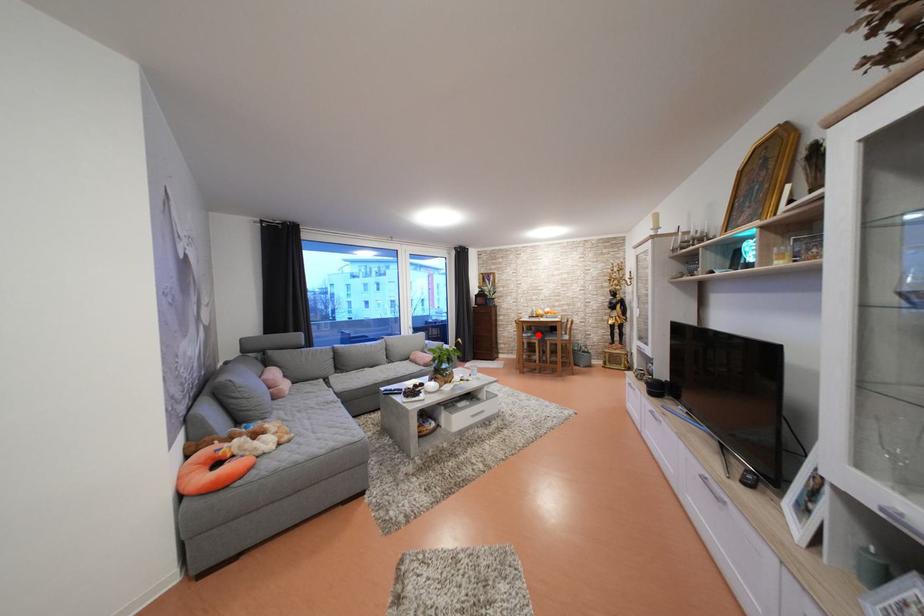
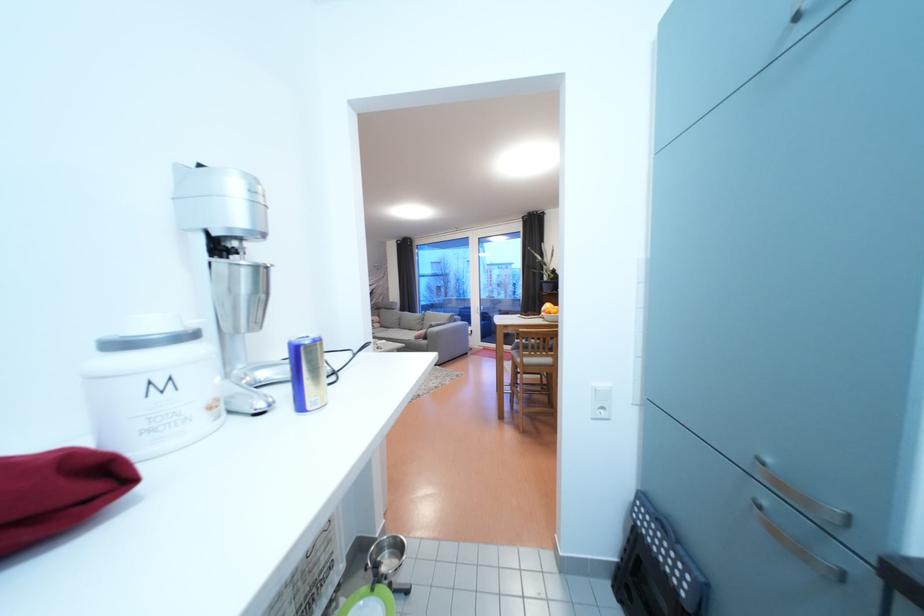
Question: I am providing you with two images of the same scene from different viewpoints. A red point is marked on the first image. At the location where the point appears in image 1, is it still visible in image 2?

Choices:
 (A) Yes
 (B) No

Answer: (B)